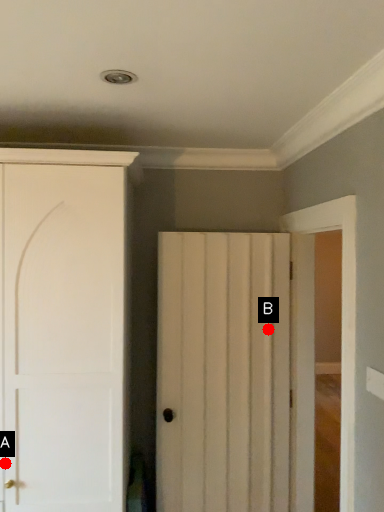
Question: Two points are circled on the image, labeled by A and B beside each circle. Which point is farther to the camera?

Choices:
 (A) A is further
 (B) B is further

Answer: (B)